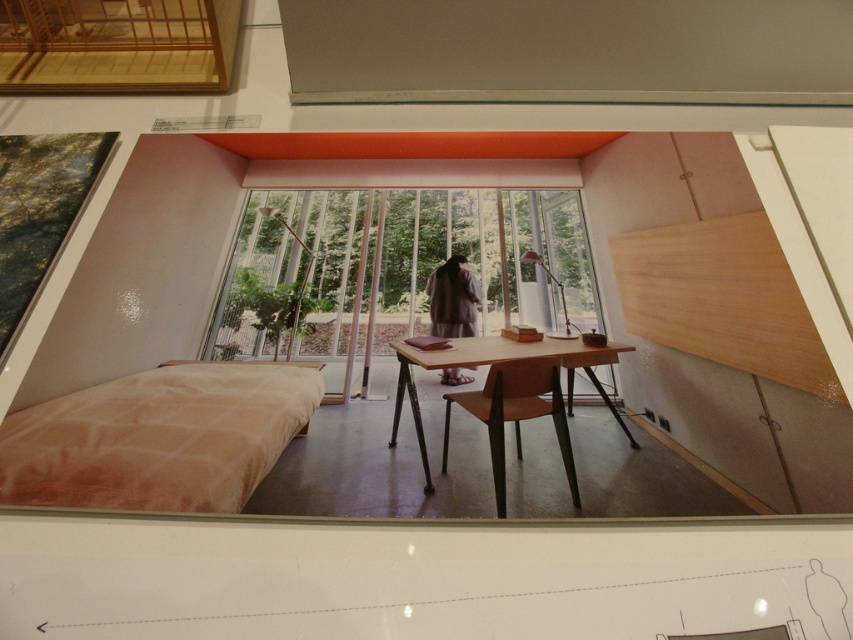
You are standing in the room and want to place a small plant on the closest object to you between the satin beige bed at lower left and the wooden table at center. Which object should you choose?

The satin beige bed at lower left is closer to the viewer than the wooden table at center, so you should place the plant on the satin beige bed at lower left.

You are standing at the entrance of the room and want to sit down. Where is the wooden chair at center located in the room?

The wooden chair at center is located at the point with coordinates 0.647 and 0.605 in the room.